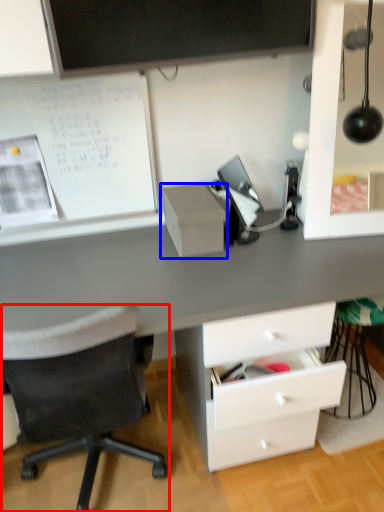
Question: Which object appears closest to the camera in this image, chair (highlighted by a red box) or shelf (highlighted by a blue box)?

Choices:
 (A) chair
 (B) shelf

Answer: (A)